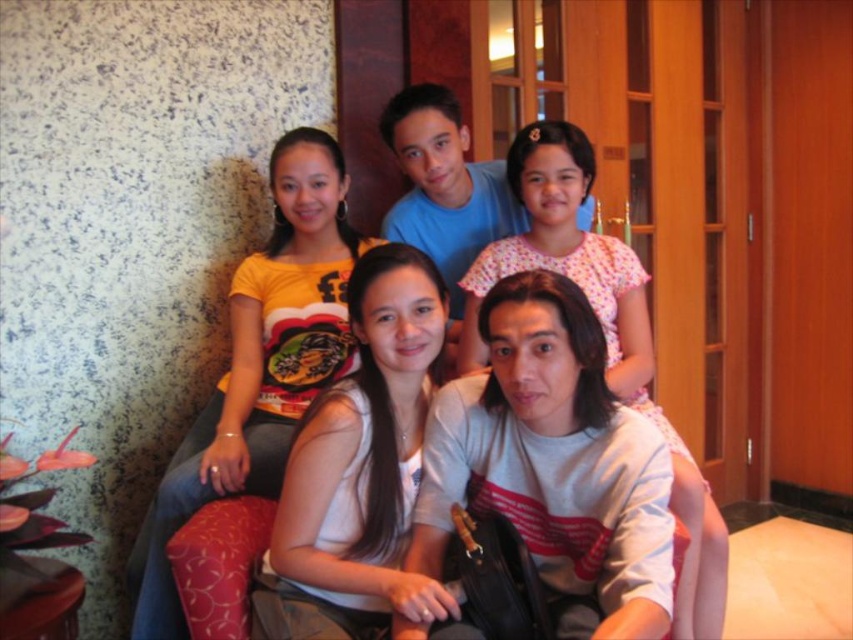
Can you confirm if yellow printed t-shirt at upper left is wider than matte blue shirt at upper center?

No.

Is yellow printed t-shirt at upper left smaller than matte blue shirt at upper center?

Actually, yellow printed t-shirt at upper left might be larger than matte blue shirt at upper center.

Between point (239, 266) and point (477, 224), which one is positioned behind?

Point (477, 224)

Find the location of a particular element. Image resolution: width=853 pixels, height=640 pixels. yellow printed t-shirt at upper left is located at coordinates (260, 364).

Is white matte shirt at center taller than pink floral dress at upper center?

No.

This screenshot has height=640, width=853. Find the location of `white matte shirt at center`. white matte shirt at center is located at coordinates (360, 468).

Does white matte shirt at center appear on the left side of matte blue shirt at upper center?

Yes, white matte shirt at center is to the left of matte blue shirt at upper center.

You are a GUI agent. You are given a task and a screenshot of the screen. Output one action in this format:
    pyautogui.click(x=<x>, y=<y>)
    Task: Click on the white matte shirt at center
    
    Given the screenshot: What is the action you would take?
    pyautogui.click(x=360, y=468)